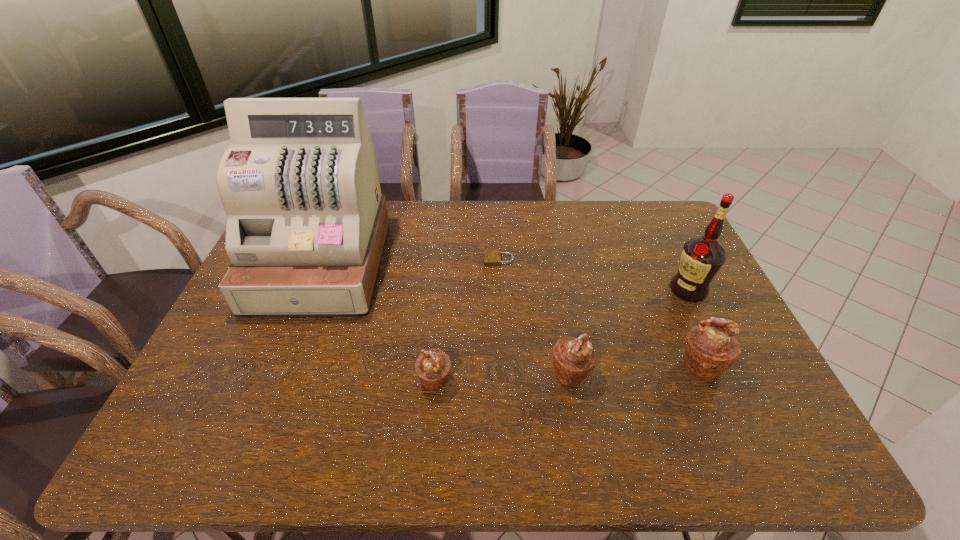
Where is `free space that satisfies the following two spatial constraints: 1. on the operating side of the leftmost object; 2. on the right side of the rightmost muffin`? free space that satisfies the following two spatial constraints: 1. on the operating side of the leftmost object; 2. on the right side of the rightmost muffin is located at coordinates (281, 366).

Image resolution: width=960 pixels, height=540 pixels. I want to click on vacant space that satisfies the following two spatial constraints: 1. on the keyhole side of the fourth object from right to left; 2. on the operating side of the leftmost object, so click(x=499, y=265).